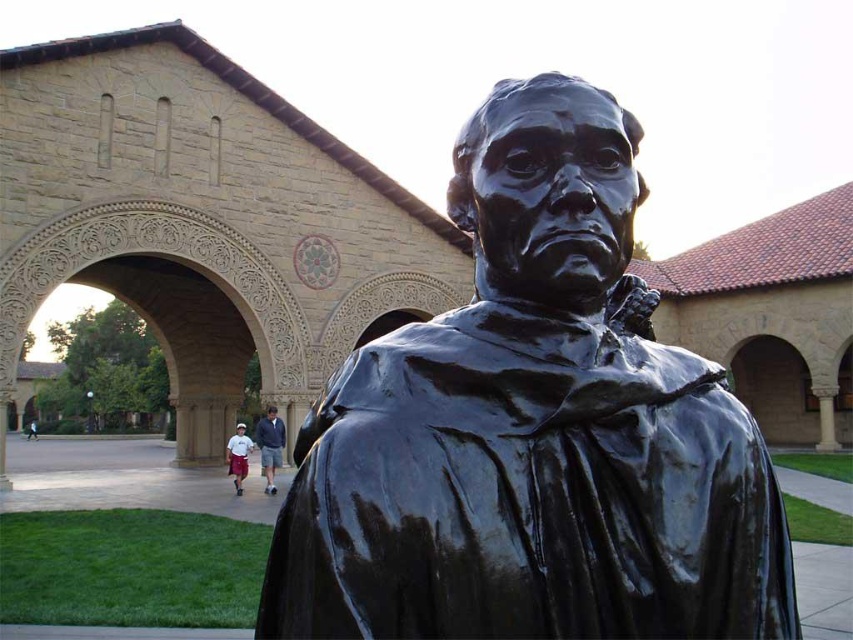
Measure the distance from light blue denim shorts at lower center to white cotton shorts at lower left.

light blue denim shorts at lower center is 8.12 feet from white cotton shorts at lower left.

Is light blue denim shorts at lower center positioned in front of white cotton shorts at lower left?

No, it is not.

Which is in front, point (254, 442) or point (231, 451)?

Point (231, 451)

I want to click on light blue denim shorts at lower center, so click(x=270, y=445).

Can you confirm if glossy bronze statue at center is smaller than light blue denim shorts at lower center?

Yes, glossy bronze statue at center is smaller than light blue denim shorts at lower center.

Is glossy bronze statue at center wider than light blue denim shorts at lower center?

No, glossy bronze statue at center is not wider than light blue denim shorts at lower center.

Which is in front, point (399, 621) or point (270, 449)?

Point (399, 621)

The height and width of the screenshot is (640, 853). Identify the location of glossy bronze statue at center. (532, 429).

Can you confirm if glossy bronze statue at center is taller than white cotton shorts at lower left?

Incorrect, glossy bronze statue at center's height is not larger of white cotton shorts at lower left's.

Who is more forward, [666,465] or [247,436]?

Point [666,465] is in front.

Is point (733, 596) more distant than point (235, 435)?

No, it is not.

The height and width of the screenshot is (640, 853). In order to click on glossy bronze statue at center in this screenshot , I will do `click(532, 429)`.